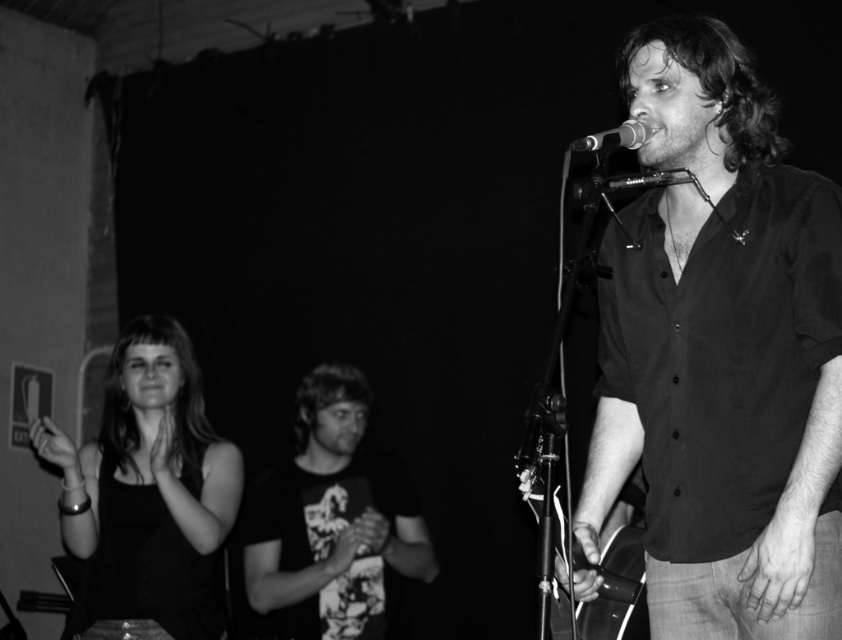
Find the location of a particular element. Image resolution: width=842 pixels, height=640 pixels. black tank top at left is located at coordinates (147, 496).

Which is in front, point (88, 584) or point (585, 566)?

Point (585, 566) is more forward.

At what (x,y) coordinates should I click in order to perform the action: click on black tank top at left. Please return your answer as a coordinate pair (x, y). Looking at the image, I should click on (147, 496).

Can you confirm if metallic acoustic guitar at center is shorter than metallic shiny microphone at upper center?

Incorrect, metallic acoustic guitar at center's height does not fall short of metallic shiny microphone at upper center's.

In the scene shown: Which is more to the left, metallic acoustic guitar at center or metallic shiny microphone at upper center?

metallic shiny microphone at upper center is more to the left.

What are the coordinates of `metallic acoustic guitar at center` in the screenshot? It's located at (619, 573).

Based on the photo, does printed cotton t-shirt at center have a larger size compared to metallic acoustic guitar at center?

Indeed, printed cotton t-shirt at center has a larger size compared to metallic acoustic guitar at center.

Is point (329, 416) positioned after point (579, 627)?

Yes.

The height and width of the screenshot is (640, 842). What are the coordinates of `printed cotton t-shirt at center` in the screenshot? It's located at (x=332, y=518).